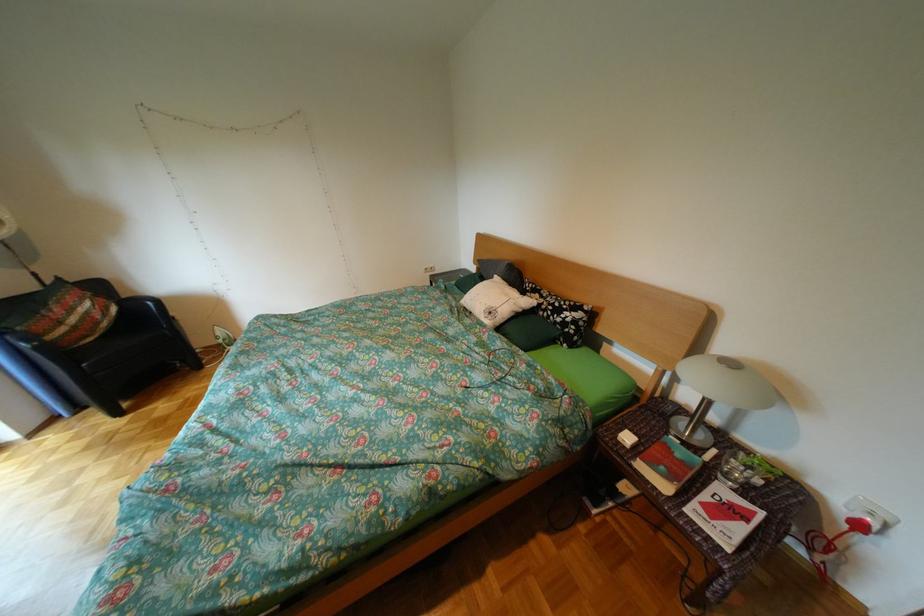
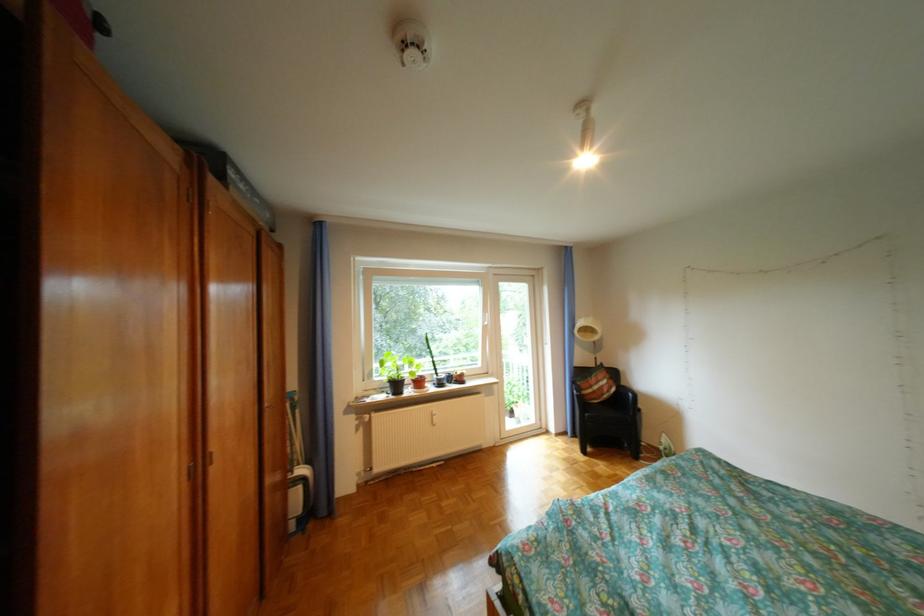
In the second image, find the point that corresponds to (x=142, y=353) in the first image.

(621, 419)